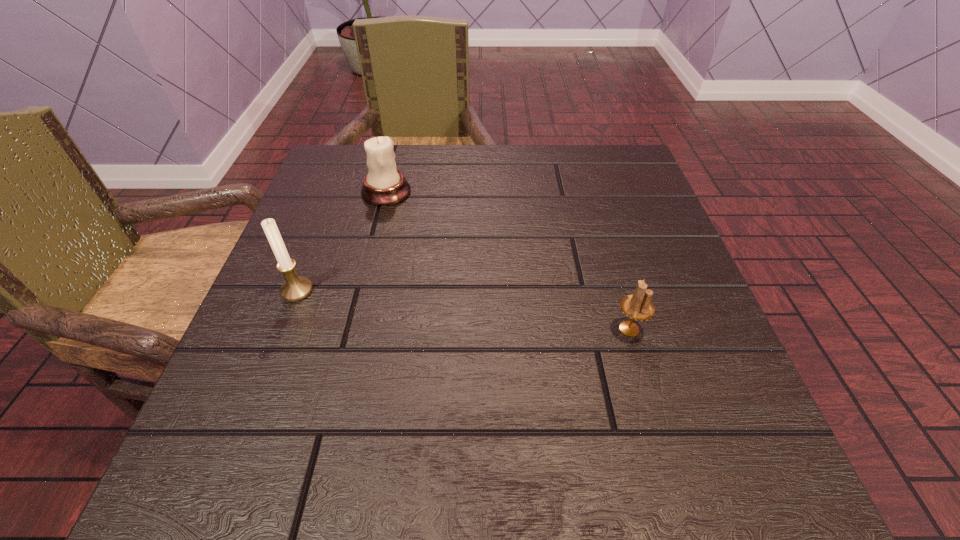
Find the location of `blank region between the farthest object and the second nearest object`. blank region between the farthest object and the second nearest object is located at coordinates (342, 241).

Where is `vacant area that lies between the second nearest candle holder and the farthest candle holder`? Image resolution: width=960 pixels, height=540 pixels. vacant area that lies between the second nearest candle holder and the farthest candle holder is located at coordinates (342, 241).

What are the coordinates of `free space between the second farthest candle holder and the nearest candle holder` in the screenshot? It's located at (463, 310).

Image resolution: width=960 pixels, height=540 pixels. I want to click on empty space that is in between the farthest object and the rightmost candle holder, so click(508, 260).

The image size is (960, 540). Find the location of `blank region between the second object from left to right and the nearest candle holder`. blank region between the second object from left to right and the nearest candle holder is located at coordinates (508, 260).

Image resolution: width=960 pixels, height=540 pixels. In order to click on empty space between the leftmost object and the rightmost object in this screenshot , I will do `click(463, 310)`.

I want to click on empty location between the second farthest candle holder and the farthest candle holder, so click(342, 241).

At what (x,y) coordinates should I click in order to perform the action: click on free space between the leftmost object and the farthest object. Please return your answer as a coordinate pair (x, y). Looking at the image, I should click on (342, 241).

Select which object appears as the second closest to the rightmost candle holder. Please provide its 2D coordinates. Your answer should be formatted as a tuple, i.e. [(x, y)], where the tuple contains the x and y coordinates of a point satisfying the conditions above.

[(295, 288)]

Identify the location of object that is the closest one to the farthest object. (295, 288).